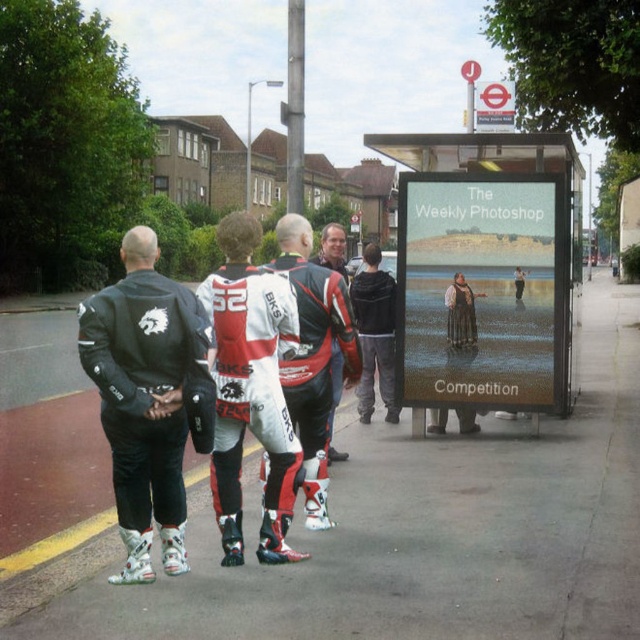
Question: Does smooth asphalt road at center appear over matte black jacket at center?

Choices:
 (A) yes
 (B) no

Answer: (B)

Question: Which point is closer to the camera?

Choices:
 (A) (195, 364)
 (B) (336, 348)
 (C) (621, 433)

Answer: (A)

Question: Does dark gray fleece jacket at center appear on the left side of matte black dress at center?

Choices:
 (A) no
 (B) yes

Answer: (A)

Question: Which of the following is the closest to the observer?

Choices:
 (A) (531, 406)
 (B) (177, 477)
 (C) (228, 298)

Answer: (C)

Question: Is matte black jacket at center smaller than matte black dress at center?

Choices:
 (A) no
 (B) yes

Answer: (A)

Question: Which point appears farthest from the camera in this image?

Choices:
 (A) (339, 269)
 (B) (560, 198)

Answer: (B)